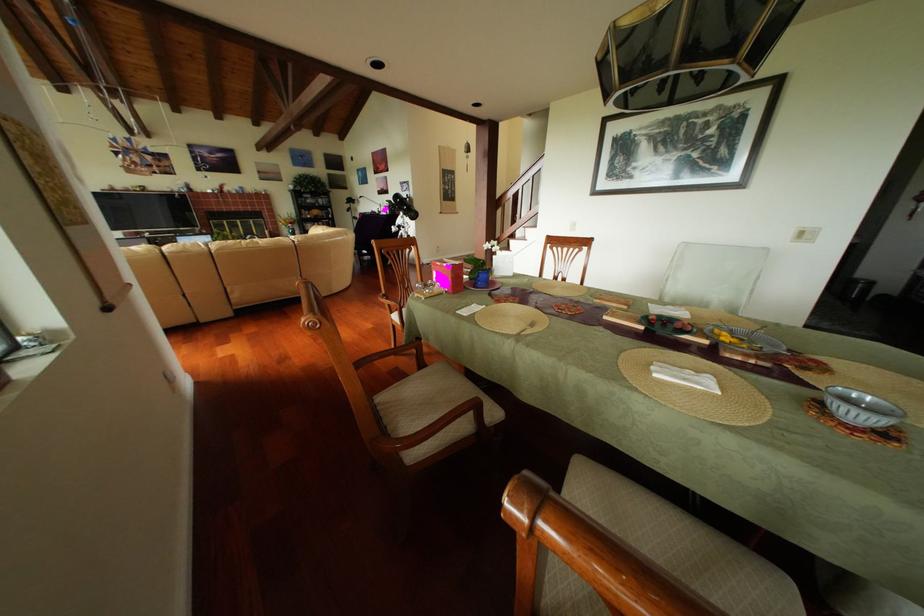
Locate an element on the screen. The image size is (924, 616). chair sitting surface is located at coordinates (426, 400).